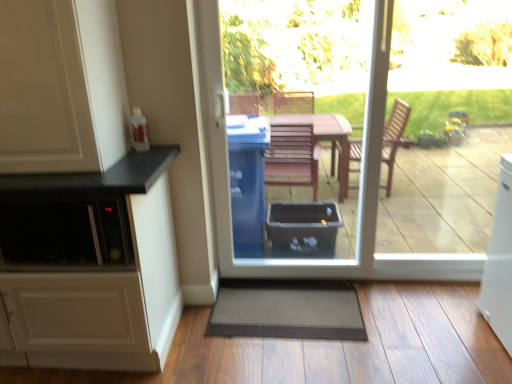
Find the location of a particular element. vacant area located to the right-hand side of gray textured mat at lower center is located at coordinates (422, 332).